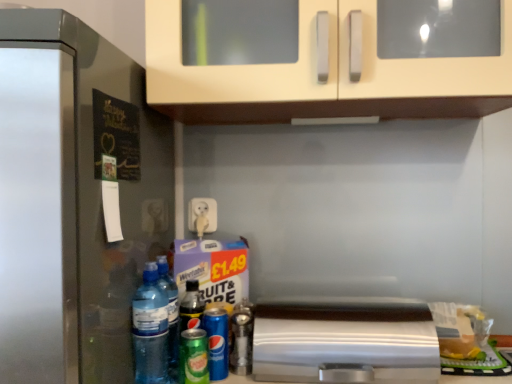
Question: Does translucent plastic water bottle at lower left, marked as the first bottle in a left-to-right arrangement, have a lesser width compared to satin silver toaster at lower center?

Choices:
 (A) yes
 (B) no

Answer: (A)

Question: From the image's perspective, is translucent plastic water bottle at lower left, the third bottle from the back, on top of satin silver toaster at lower center?

Choices:
 (A) yes
 (B) no

Answer: (A)

Question: Considering the relative sizes of translucent plastic water bottle at lower left, marked as the first bottle in a left-to-right arrangement, and satin silver toaster at lower center in the image provided, is translucent plastic water bottle at lower left, marked as the first bottle in a left-to-right arrangement, wider than satin silver toaster at lower center?

Choices:
 (A) no
 (B) yes

Answer: (A)

Question: Does translucent plastic water bottle at lower left, marked as the first bottle in a left-to-right arrangement, have a greater height compared to satin silver toaster at lower center?

Choices:
 (A) yes
 (B) no

Answer: (A)

Question: Is translucent plastic water bottle at lower left, which ranks as the 3th bottle in right-to-left order, further to camera compared to satin silver toaster at lower center?

Choices:
 (A) yes
 (B) no

Answer: (B)

Question: Does point (177, 342) appear closer or farther from the camera than point (243, 332)?

Choices:
 (A) closer
 (B) farther

Answer: (A)

Question: In the image, is transparent plastic bottle at lower left, the 2th bottle from the left, on the left side or the right side of metallic silver spray can at center, arranged as the 1th bottle when viewed from the right?

Choices:
 (A) right
 (B) left

Answer: (B)

Question: Is transparent plastic bottle at lower left, positioned as the 2th bottle in right-to-left order, in front of or behind metallic silver spray can at center, the 3th bottle in the left-to-right sequence, in the image?

Choices:
 (A) front
 (B) behind

Answer: (A)

Question: Looking at the image, does transparent plastic bottle at lower left, which appears as the second bottle when viewed from the front, seem bigger or smaller compared to metallic silver spray can at center, the 3th bottle in the left-to-right sequence?

Choices:
 (A) small
 (B) big

Answer: (B)

Question: Is point (202, 349) closer or farther from the camera than point (229, 339)?

Choices:
 (A) farther
 (B) closer

Answer: (B)

Question: Would you say green matte can at lower center, which is the 2th beer in back-to-front order, is to the left or to the right of metallic silver spray can at center, arranged as the third bottle when viewed from the front, in the picture?

Choices:
 (A) left
 (B) right

Answer: (A)

Question: Do you think green matte can at lower center, positioned as the 1th beer in front-to-back order, is within metallic silver spray can at center, arranged as the 1th bottle when viewed from the right, or outside of it?

Choices:
 (A) inside
 (B) outside

Answer: (B)

Question: Considering the positions of green matte can at lower center, which is the 2th beer in back-to-front order, and metallic silver spray can at center, which appears as the first bottle when viewed from the back, in the image, is green matte can at lower center, which is the 2th beer in back-to-front order, taller or shorter than metallic silver spray can at center, which appears as the first bottle when viewed from the back,?

Choices:
 (A) tall
 (B) short

Answer: (B)

Question: From the image's perspective, is green matte can at lower center, which is the 2th beer in back-to-front order, located above or below blue metallic can at lower center, the second beer from the front?

Choices:
 (A) above
 (B) below

Answer: (B)

Question: Is green matte can at lower center, which is the 2th beer in back-to-front order, spatially inside blue metallic can at lower center, the second beer from the front, or outside of it?

Choices:
 (A) outside
 (B) inside

Answer: (A)